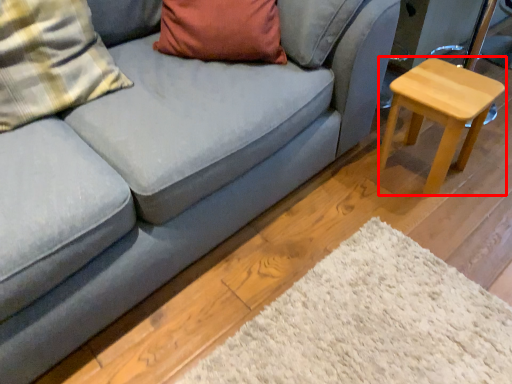
Question: Considering the relative positions of stool (annotated by the red box) and pillow in the image provided, where is stool (annotated by the red box) located with respect to the staircase?

Choices:
 (A) right
 (B) left

Answer: (A)